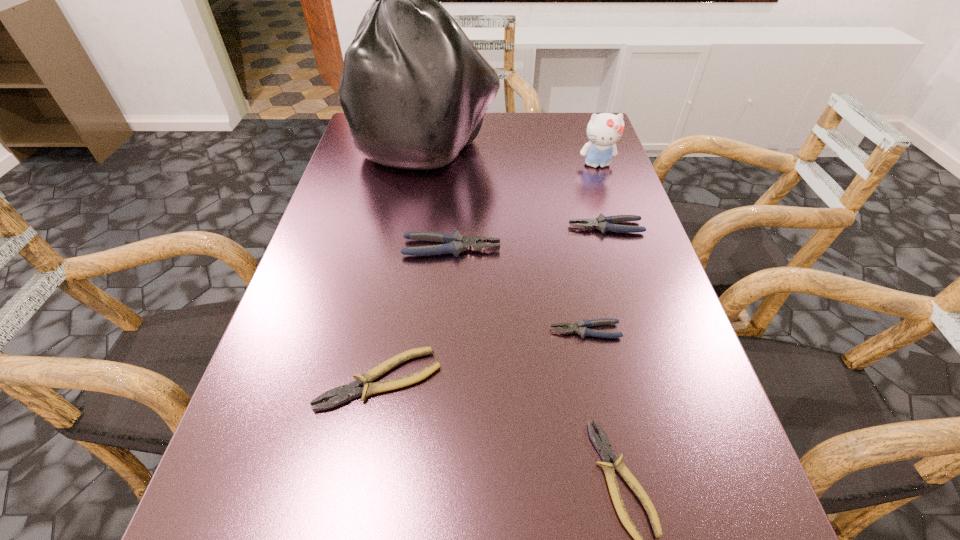
The image size is (960, 540). I want to click on free space located on the right of the plastic bag, so click(564, 144).

You are a GUI agent. You are given a task and a screenshot of the screen. Output one action in this format:
    pyautogui.click(x=<x>, y=<y>)
    Task: Click on the vacant space situated on the front-facing side of the kitten
    
    Given the screenshot: What is the action you would take?
    pyautogui.click(x=631, y=264)

Identify the location of blank space located 0.160m at the gripping part of the second farthest gray pliers. This screenshot has width=960, height=540. (574, 248).

Identify the location of free space located at the gripping part of the second tallest pliers. (490, 227).

Where is `vacant point located 0.300m at the gripping part of the second tallest pliers`? The image size is (960, 540). vacant point located 0.300m at the gripping part of the second tallest pliers is located at coordinates (437, 227).

Find the location of a particular element. This screenshot has width=960, height=540. vacant area situated 0.140m at the gripping part of the second tallest pliers is located at coordinates (507, 227).

You are a GUI agent. You are given a task and a screenshot of the screen. Output one action in this format:
    pyautogui.click(x=<x>, y=<y>)
    Task: Click on the free spot located on the back of the sixth farthest object
    The height and width of the screenshot is (540, 960).
    Given the screenshot: What is the action you would take?
    pyautogui.click(x=398, y=276)

Where is `free space located 0.150m at the gripping part of the nearest gray pliers`? free space located 0.150m at the gripping part of the nearest gray pliers is located at coordinates (468, 330).

Where is `free space located 0.380m at the gripping part of the nearest gray pliers`? The height and width of the screenshot is (540, 960). free space located 0.380m at the gripping part of the nearest gray pliers is located at coordinates (341, 330).

What are the coordinates of `free space located 0.260m at the gripping part of the nearest gray pliers` in the screenshot? It's located at (407, 330).